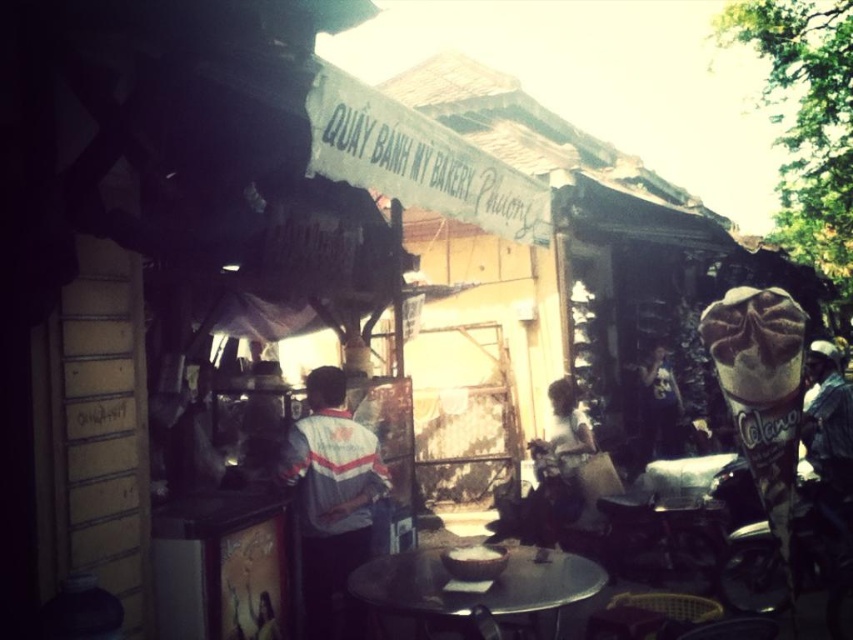
You are a customer standing at the entrance of QUAY BACH M YORK Phuong. You want to place your bag on the nearest surface. Which object should you choose between the gray striped shirt at center and the metallic round table at center?

The metallic round table at center is the nearest surface because it is only 35.90 inches away from the gray striped shirt at center, which is where you are standing.

What are the coordinates of the gray striped shirt at center in the image?

The gray striped shirt at center is located at coordinates point (331, 493).

You are a customer standing at the entrance of QUAY BAHN M MY BAKERY Phuong. You see the gray striped shirt at center and the metallic round table at center. Which object is closer to you?

The gray striped shirt at center is closer to you because it is positioned over the metallic round table at center.